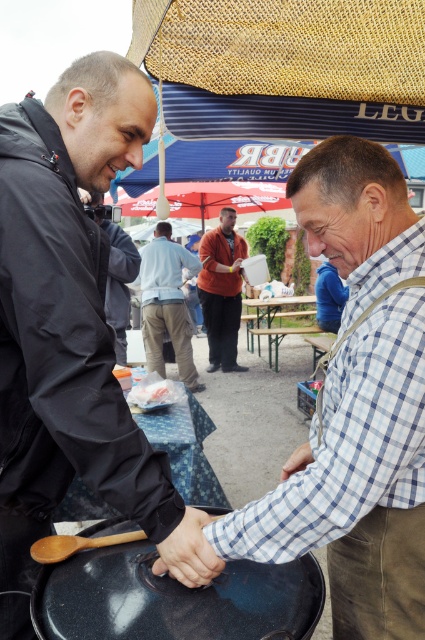
Is matte black pan at lower left to the right of light blue plaid shirt at center from the viewer's perspective?

In fact, matte black pan at lower left is to the left of light blue plaid shirt at center.

You are a GUI agent. You are given a task and a screenshot of the screen. Output one action in this format:
    pyautogui.click(x=<x>, y=<y>)
    Task: Click on the matte black pan at lower left
    Image resolution: width=425 pixels, height=640 pixels.
    Given the screenshot: What is the action you would take?
    [65, 320]

The width and height of the screenshot is (425, 640). Describe the element at coordinates (357, 404) in the screenshot. I see `blue checkered shirt at center` at that location.

Where is `blue checkered shirt at center`? Image resolution: width=425 pixels, height=640 pixels. blue checkered shirt at center is located at coordinates (357, 404).

Is blue checkered shirt at center to the right of light blue shirt at center from the viewer's perspective?

Correct, you'll find blue checkered shirt at center to the right of light blue shirt at center.

Who is positioned more to the right, blue checkered shirt at center or light blue shirt at center?

blue checkered shirt at center is more to the right.

Is point (419, 349) closer to camera compared to point (161, 292)?

Yes, it is in front of point (161, 292).

The width and height of the screenshot is (425, 640). Identify the location of blue checkered shirt at center. (357, 404).